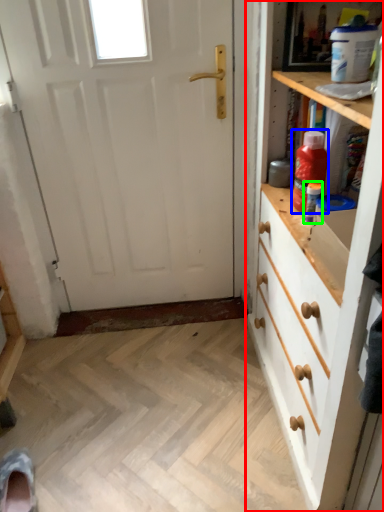
Question: Which object is positioned farthest from chest of drawers (highlighted by a red box)? Select from bottle (highlighted by a blue box) and bottle (highlighted by a green box).

Choices:
 (A) bottle
 (B) bottle

Answer: (B)